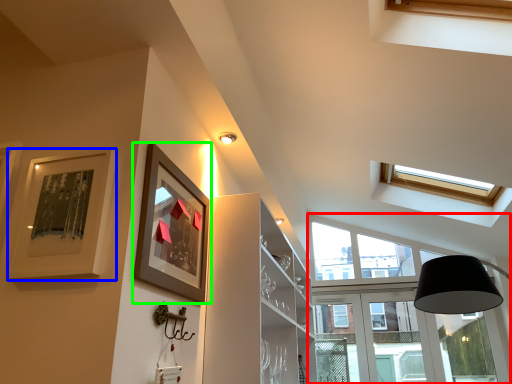
Question: Considering the real-world distances, which object is farthest from window (highlighted by a red box)? picture frame (highlighted by a blue box) or picture frame (highlighted by a green box)?

Choices:
 (A) picture frame
 (B) picture frame

Answer: (A)